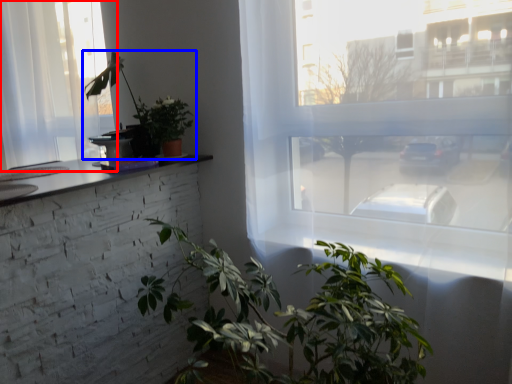
Question: Which of the following is the farthest to the observer, window (highlighted by a red box) or houseplant (highlighted by a blue box)?

Choices:
 (A) window
 (B) houseplant

Answer: (A)